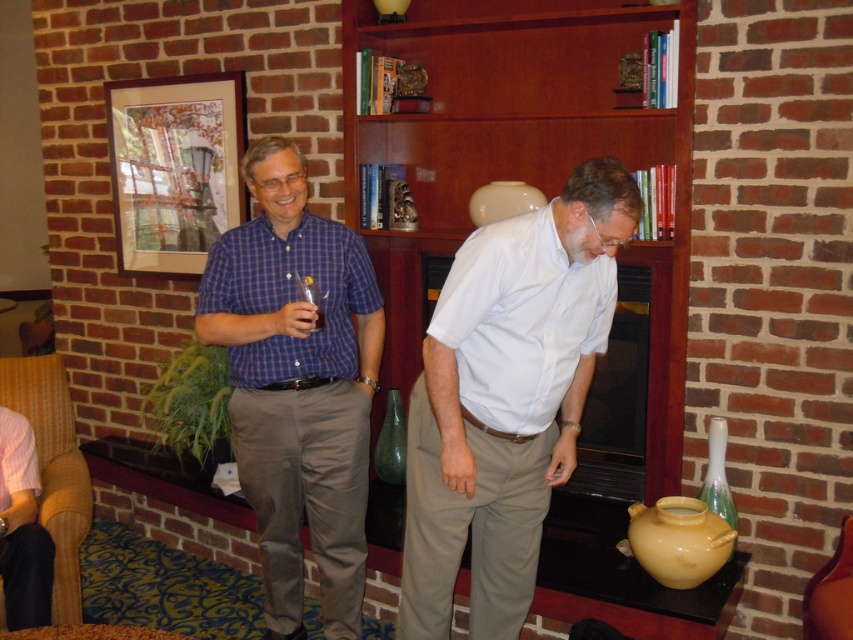
Question: Does white matte shirt at center have a smaller size compared to brown fabric armchair at lower left?

Choices:
 (A) no
 (B) yes

Answer: (A)

Question: Is white matte shirt at center in front of matte pink shirt at lower left?

Choices:
 (A) no
 (B) yes

Answer: (B)

Question: Which point is farther to the camera?

Choices:
 (A) (331, 579)
 (B) (22, 449)
 (C) (419, 240)
 (D) (619, 320)

Answer: (C)

Question: Is blue plaid shirt at center thinner than black glass fireplace at center?

Choices:
 (A) yes
 (B) no

Answer: (B)

Question: Which is nearer to the blue plaid shirt at center?

Choices:
 (A) white matte shirt at center
 (B) brown fabric armchair at lower left

Answer: (A)

Question: Which of the following is the closest to the observer?

Choices:
 (A) (26, 625)
 (B) (611, 362)
 (C) (20, 369)

Answer: (A)